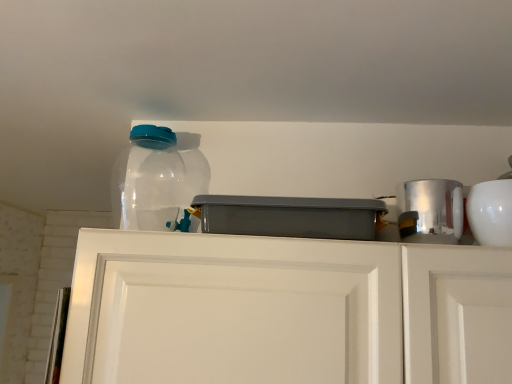
Question: Relative to silver metallic canister at right, which is the 2th appliance from right to left, is gray plastic container at center, marked as the third appliance in a right-to-left arrangement, in front or behind?

Choices:
 (A) behind
 (B) front

Answer: (B)

Question: Is gray plastic container at center, placed as the 1th appliance when sorted from left to right, bigger or smaller than silver metallic canister at right, which is the 2th appliance from right to left?

Choices:
 (A) small
 (B) big

Answer: (B)

Question: Which is nearer to the white matte cabinet doors at center?

Choices:
 (A) transparent plastic bottle at upper left
 (B) white glossy bowl at upper right, positioned as the 3th appliance in left-to-right order
 (C) gray plastic container at center, placed as the 1th appliance when sorted from left to right
 (D) silver metallic canister at right, which is the 2th appliance from right to left

Answer: (C)

Question: Which of these objects is positioned farthest from the gray plastic container at center, marked as the third appliance in a right-to-left arrangement?

Choices:
 (A) transparent plastic bottle at upper left
 (B) white matte cabinet doors at center
 (C) silver metallic canister at right, which is the 2th appliance from right to left
 (D) white glossy bowl at upper right, marked as the first appliance in a right-to-left arrangement

Answer: (D)